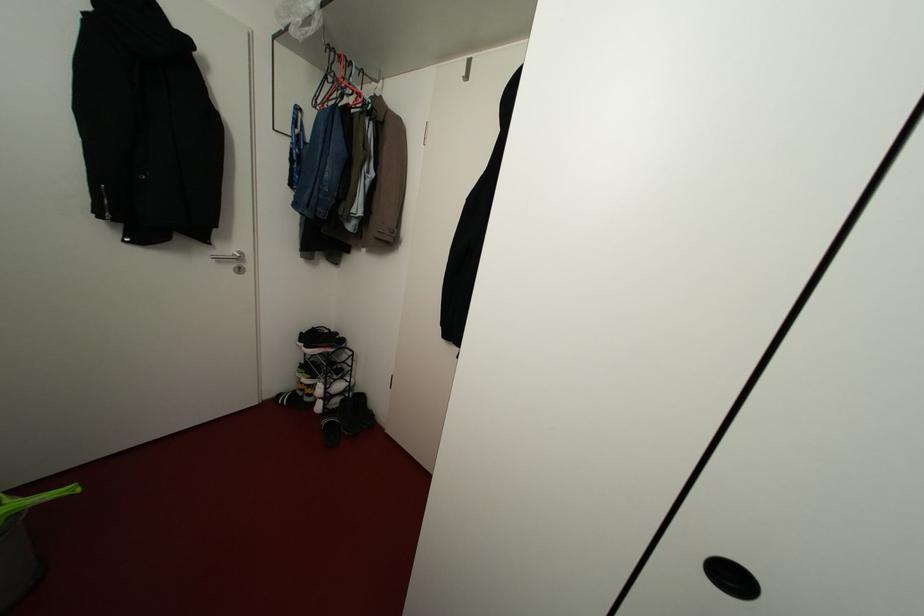
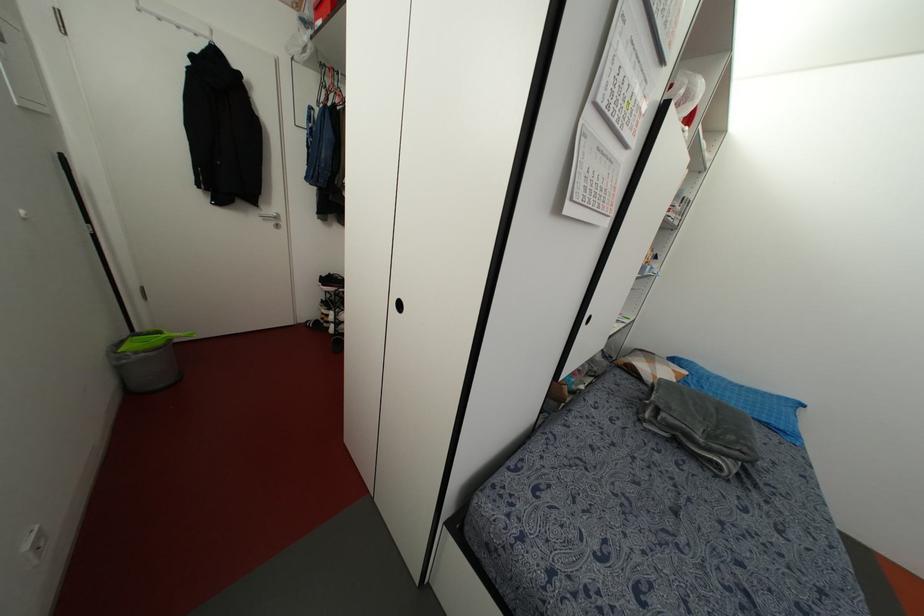
Find the pixel in the second image that matches (238,270) in the first image.

(276, 225)